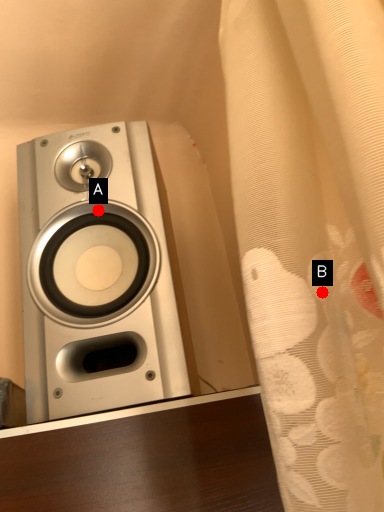
Question: Two points are circled on the image, labeled by A and B beside each circle. Which point appears closest to the camera in this image?

Choices:
 (A) A is closer
 (B) B is closer

Answer: (B)